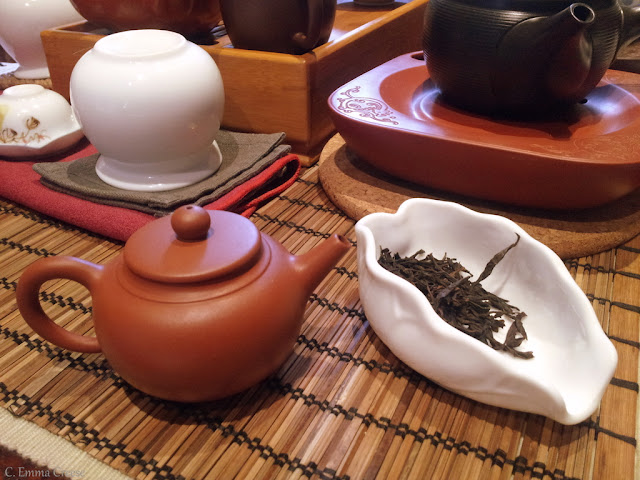
This screenshot has width=640, height=480. What are the coordinates of `pots` in the screenshot? It's located at (237, 271), (477, 81), (265, 22), (123, 18).